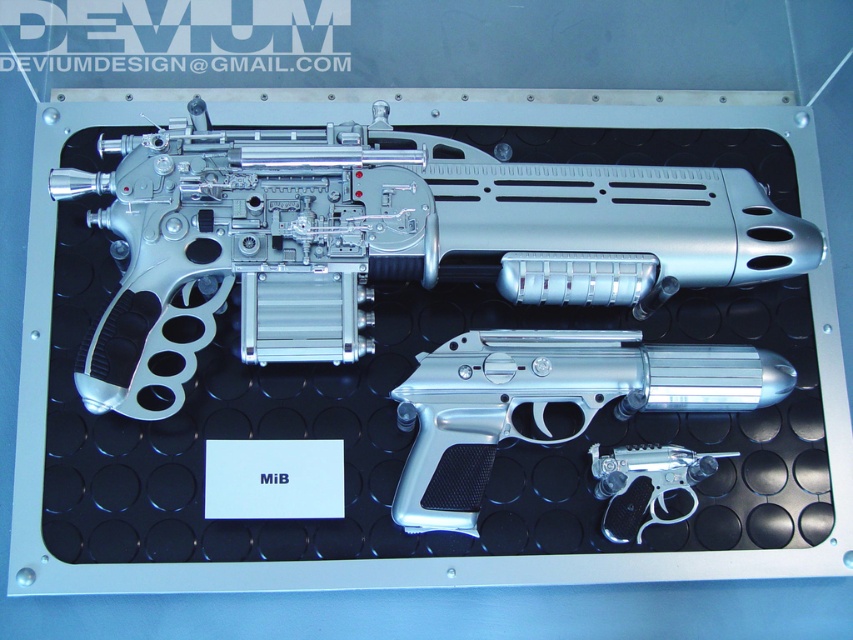
Question: Which point appears closest to the camera in this image?

Choices:
 (A) (711, 227)
 (B) (671, 349)

Answer: (B)

Question: Does silver metallic rifle at upper center appear on the right side of polished silver handgun at lower right?

Choices:
 (A) yes
 (B) no

Answer: (B)

Question: From the image, what is the correct spatial relationship of silver metallic rifle at upper center in relation to silver metallic handgun at center?

Choices:
 (A) above
 (B) below

Answer: (A)

Question: Does silver metallic rifle at upper center have a larger size compared to silver metallic handgun at center?

Choices:
 (A) yes
 (B) no

Answer: (A)

Question: Which of the following is the closest to the observer?

Choices:
 (A) silver metallic rifle at upper center
 (B) silver metallic handgun at center

Answer: (A)

Question: Considering the real-world distances, which object is closest to the silver metallic rifle at upper center?

Choices:
 (A) silver metallic handgun at center
 (B) polished silver handgun at lower right

Answer: (A)